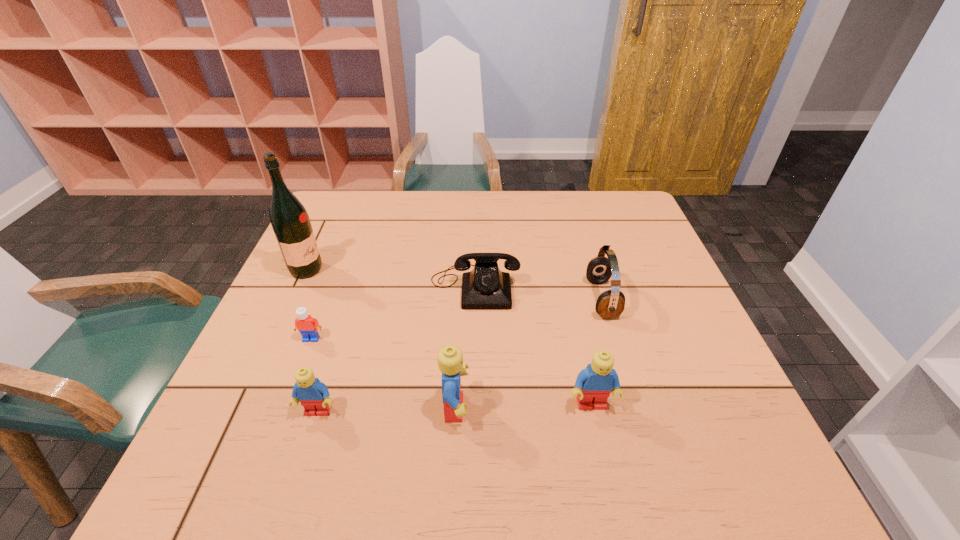
Where is `vacant space situated on the face of the third Lego from left to right`? The height and width of the screenshot is (540, 960). vacant space situated on the face of the third Lego from left to right is located at coordinates (606, 408).

Find the location of a particular element. vacant space located on the front-facing side of the tallest object is located at coordinates click(x=399, y=269).

Where is `blank area located 0.090m on the ear cups of the rightmost object`? blank area located 0.090m on the ear cups of the rightmost object is located at coordinates click(553, 299).

Locate an element on the screen. This screenshot has width=960, height=540. vacant space located 0.090m on the ear cups of the rightmost object is located at coordinates (553, 299).

Where is `free space located on the ear cups of the rightmost object`? free space located on the ear cups of the rightmost object is located at coordinates 529,299.

The image size is (960, 540). I want to click on vacant position located on the front face of the telephone, so click(473, 420).

I want to click on vacant space located 0.170m on the face of the shortest Lego, so click(285, 408).

Identify the location of liquor located at the left edge. (290, 221).

Where is `object present at the near left corner`? This screenshot has height=540, width=960. object present at the near left corner is located at coordinates (314, 396).

Where is `free space at the far edge of the desktop`? The height and width of the screenshot is (540, 960). free space at the far edge of the desktop is located at coordinates (434, 230).